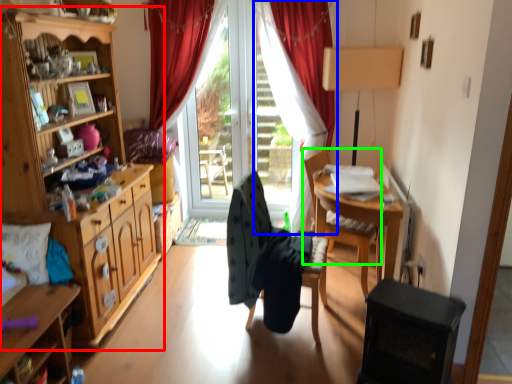
Question: Considering the real-world distances, which object is farthest from cabinetry (highlighted by a red box)? curtain (highlighted by a blue box) or chair (highlighted by a green box)?

Choices:
 (A) curtain
 (B) chair

Answer: (A)